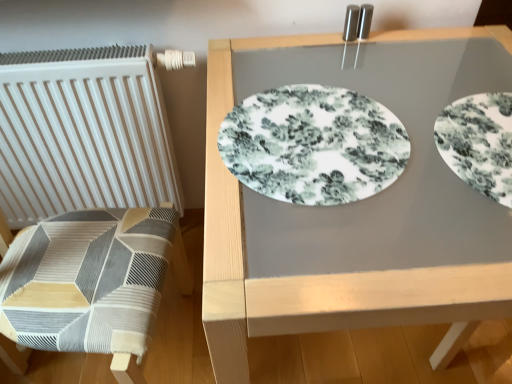
Where is `free space above white glossy placemat at center (from a real-world perspective)`? free space above white glossy placemat at center (from a real-world perspective) is located at coordinates pos(347,143).